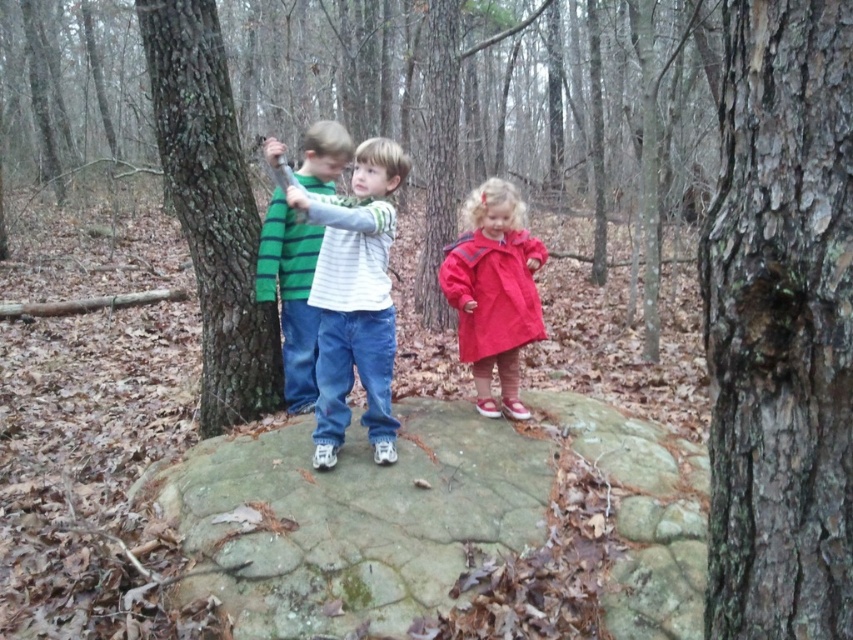
Which is more to the right, green mossy rock at center or striped cotton shirt at center?

green mossy rock at center is more to the right.

Can you confirm if green mossy rock at center is positioned to the left of striped cotton shirt at center?

In fact, green mossy rock at center is to the right of striped cotton shirt at center.

Is point (445, 412) positioned in front of point (283, 248)?

Yes, point (445, 412) is closer to viewer.

This screenshot has height=640, width=853. Identify the location of green mossy rock at center. (433, 516).

Consider the image. Who is taller, green mossy rock at center or white striped shirt at center?

white striped shirt at center is taller.

This screenshot has height=640, width=853. I want to click on green mossy rock at center, so [433, 516].

Find the location of a particular element. This screenshot has width=853, height=640. green mossy rock at center is located at coordinates (433, 516).

Who is more distant from viewer, [469,269] or [287,214]?

Answer: The point [287,214] is behind.

The image size is (853, 640). I want to click on matte red coat at center, so click(x=494, y=291).

Between point (527, 257) and point (308, 339), which one is positioned behind?

The point (308, 339) is more distant.

Image resolution: width=853 pixels, height=640 pixels. I want to click on matte red coat at center, so click(x=494, y=291).